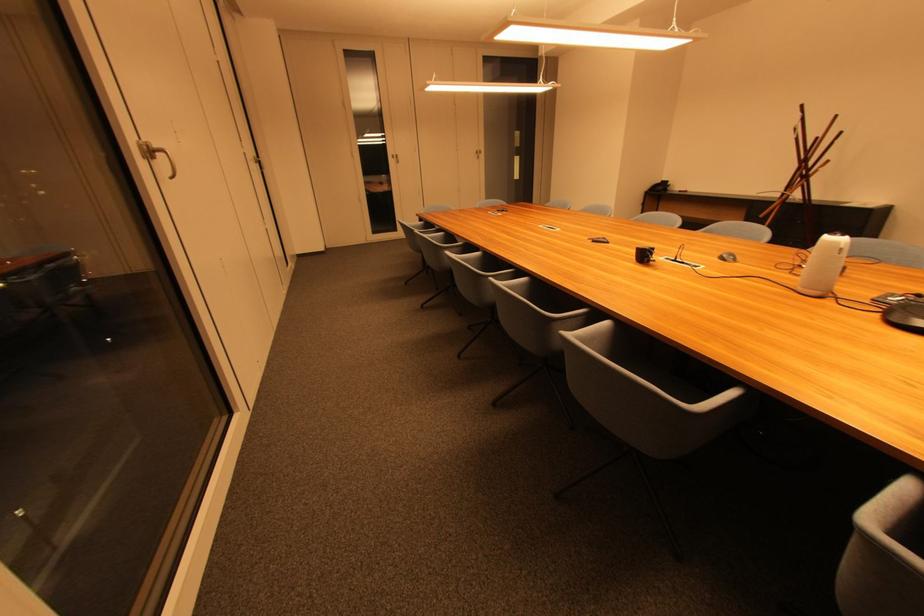
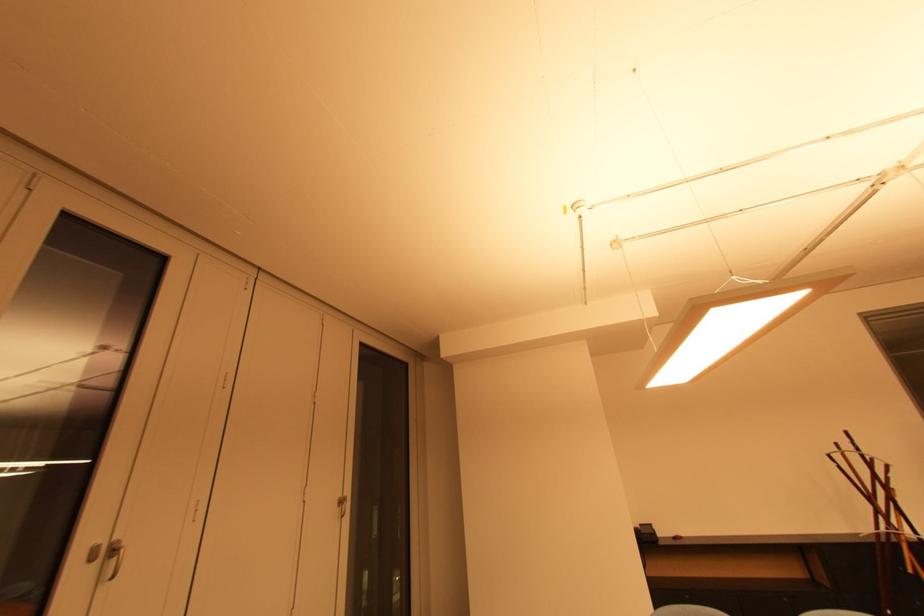
In the second image, find the point that corresponds to point (482, 155) in the first image.

(346, 504)